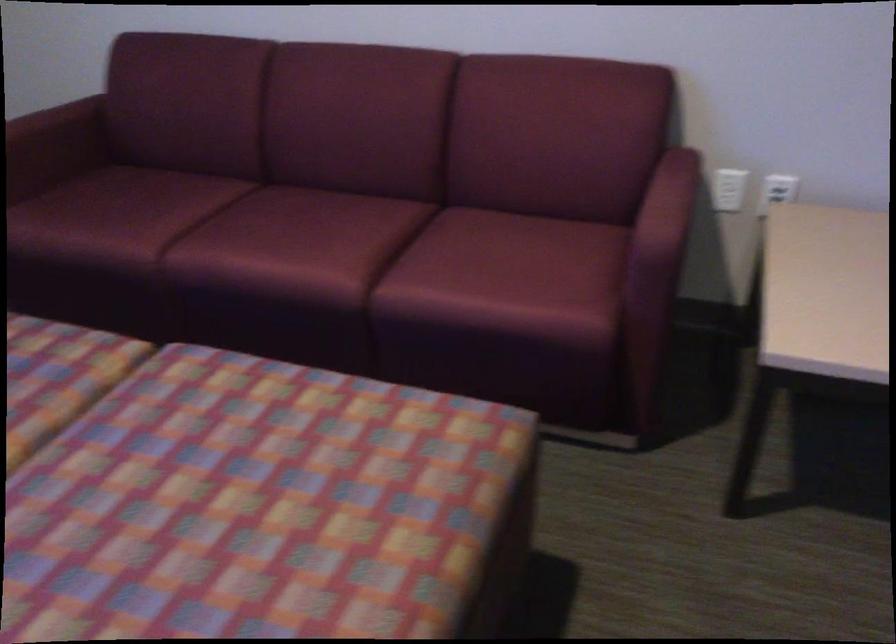
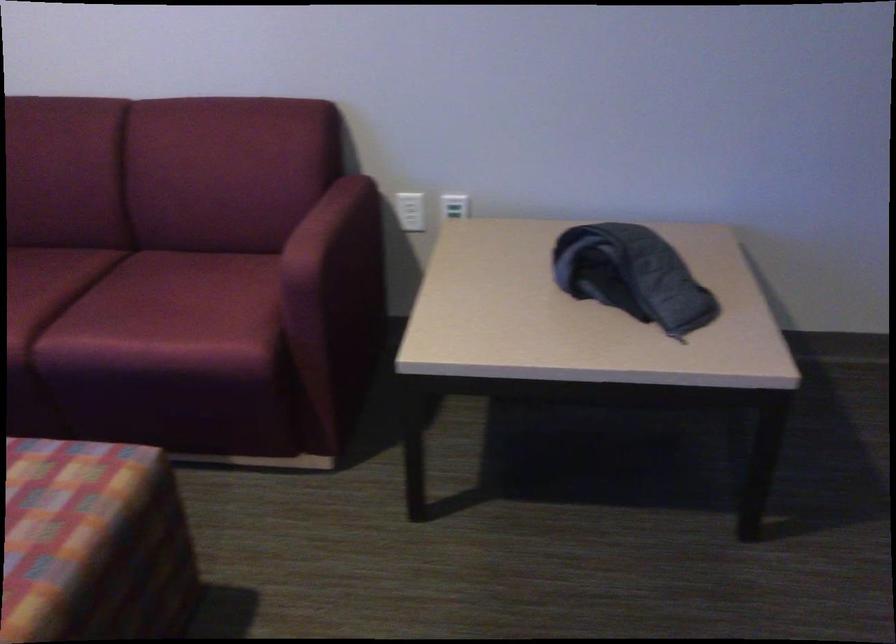
Question: Based on the continuous images, in which direction is the camera rotating? Reply with the corresponding letter.

Choices:
 (A) Left
 (B) Right
 (C) Up
 (D) Down

Answer: (B)